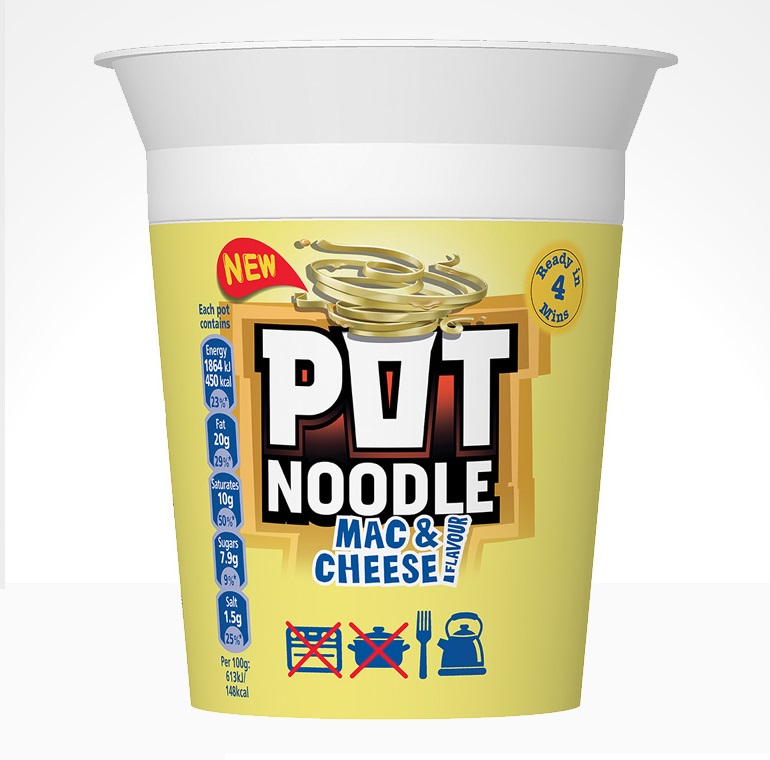
This screenshot has height=760, width=770. I want to click on pot, so click(380, 638).